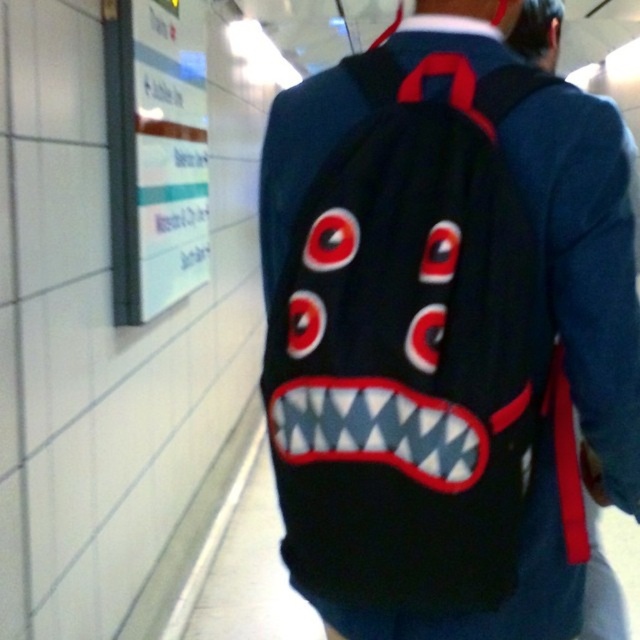
Question: Observing the image, what is the correct spatial positioning of black fabric backpack at upper center in reference to white glossy signboard at upper left?

Choices:
 (A) left
 (B) right

Answer: (B)

Question: Is black fabric backpack at upper center above white glossy signboard at upper left?

Choices:
 (A) no
 (B) yes

Answer: (A)

Question: Which of the following is the farthest from the observer?

Choices:
 (A) black fabric backpack at upper center
 (B) white glossy signboard at upper left

Answer: (B)

Question: Among these objects, which one is farthest from the camera?

Choices:
 (A) white glossy signboard at upper left
 (B) black fabric backpack at upper center

Answer: (A)

Question: Does black fabric backpack at upper center appear on the left side of white glossy signboard at upper left?

Choices:
 (A) yes
 (B) no

Answer: (B)